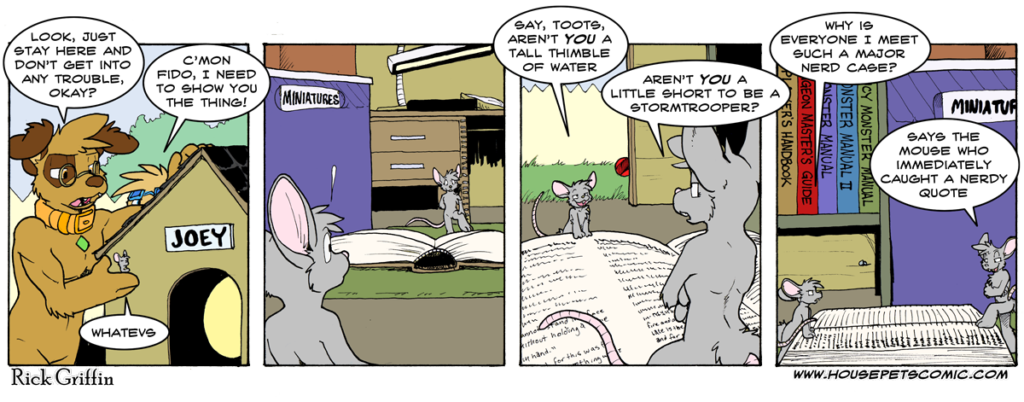
You are a GUI agent. You are given a task and a screenshot of the screen. Output one action in this format:
    pyautogui.click(x=<x>, y=<y>)
    Task: Click on the desk
    This screenshot has width=1024, height=402.
    Given the screenshot: What is the action you would take?
    pyautogui.click(x=436, y=140)